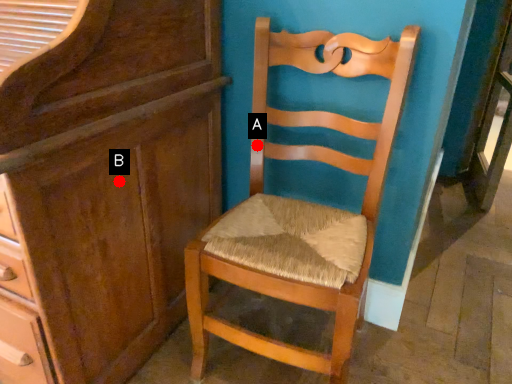
Question: Two points are circled on the image, labeled by A and B beside each circle. Which point is closer to the camera?

Choices:
 (A) A is closer
 (B) B is closer

Answer: (B)